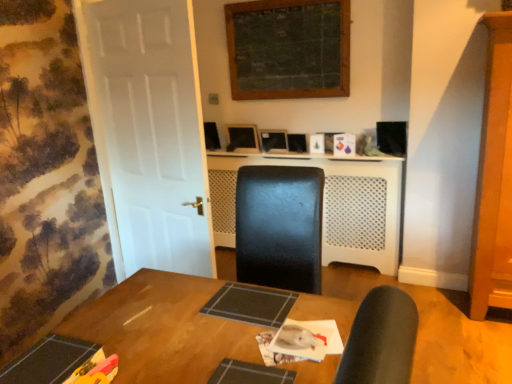
Question: Does point (237, 135) appear closer or farther from the camera than point (327, 233)?

Choices:
 (A) farther
 (B) closer

Answer: (A)

Question: Looking at the image, does matte black monitor at center seem bigger or smaller compared to white perforated plastic at center?

Choices:
 (A) small
 (B) big

Answer: (A)

Question: Which object is positioned farthest from the white matte door at left?

Choices:
 (A) wooden table at center
 (B) matte black monitor at center
 (C) white perforated plastic at center

Answer: (B)

Question: Which object is positioned farthest from the white matte door at left?

Choices:
 (A) white perforated plastic at center
 (B) wooden table at center
 (C) matte black monitor at center

Answer: (C)